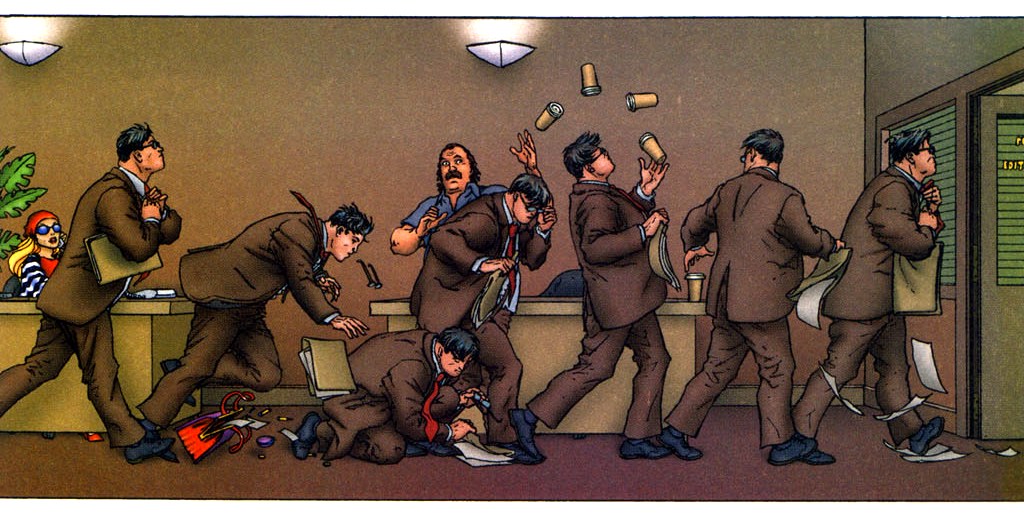
Where is `wall`? This screenshot has height=513, width=1024. wall is located at coordinates (267, 121), (923, 45).